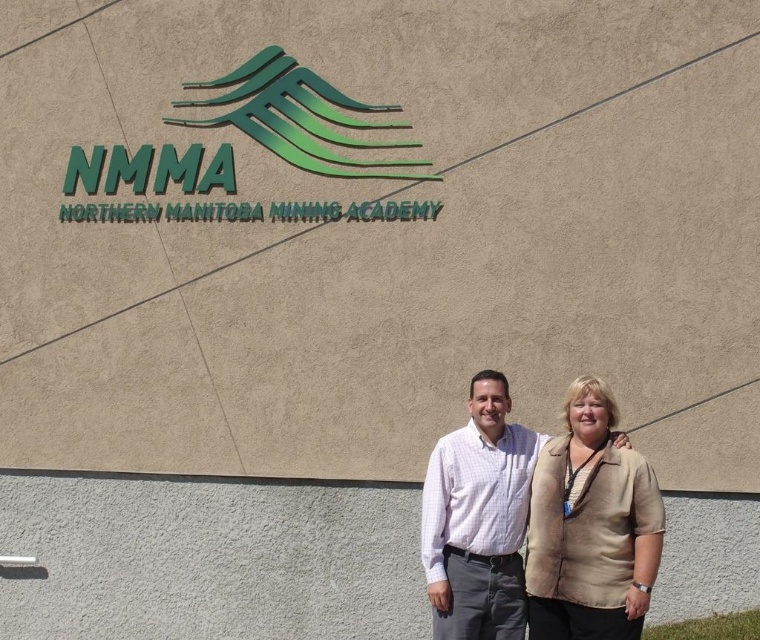
You are a photographer setting up a shot of the two people in front of the NMMA building. You want to ensure that both the beige fabric jacket at lower right and the white checkered shirt at center are fully visible in the frame. Based on their positions and sizes, do you think you need to adjust the camera angle to include both?

The beige fabric jacket at lower right might be wider than the white checkered shirt at center, so you may need to adjust the camera angle to ensure both are fully visible in the frame.

You are a photographer standing at the NMMA building entrance. You want to capture a photo of the beige fabric jacket at lower right and the white checkered shirt at center. The minimum distance required for your camera to focus clearly on both subjects simultaneously is 24 centimeters. Based on the scene, will your camera be able to focus on both subjects?

The distance between the beige fabric jacket at lower right and the white checkered shirt at center is 23.55 centimeters. Since this is less than the required 24 centimeters, the camera should be able to focus on both subjects clearly.

You are standing in front of the NMMA building and notice a point marked at coordinates (591,525). Based on the scene description, what object is located at this point?

The point at coordinates (591,525) indicates the beige fabric jacket at lower right.